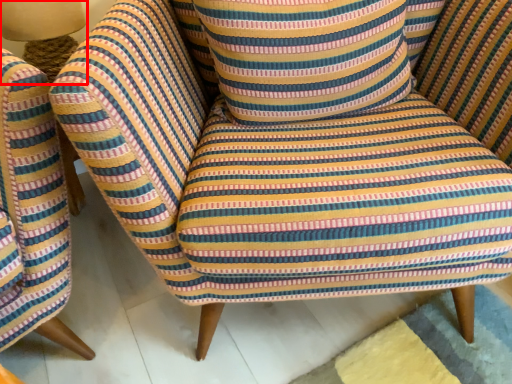
Question: From the image's perspective, what is the correct spatial positioning of table lamp (annotated by the red box) in reference to throw pillow?

Choices:
 (A) below
 (B) above

Answer: (B)